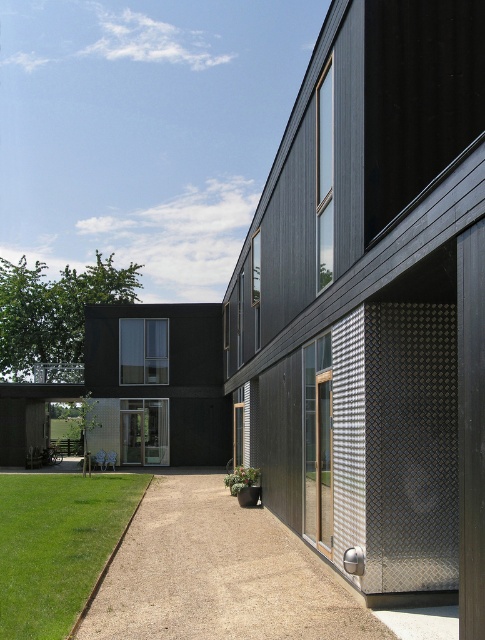
Who is positioned more to the left, smooth gravel driveway at center or green grass at lower left?

Positioned to the left is green grass at lower left.

Can you confirm if smooth gravel driveway at center is taller than green grass at lower left?

In fact, smooth gravel driveway at center may be shorter than green grass at lower left.

Identify the location of smooth gravel driveway at center. This screenshot has height=640, width=485. (219, 573).